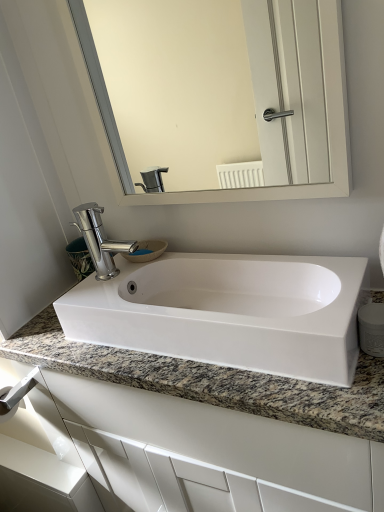
Question: From the image's perspective, is satin nickel towel bar at lower left over white glossy sink at center?

Choices:
 (A) no
 (B) yes

Answer: (A)

Question: Is satin nickel towel bar at lower left positioned beyond the bounds of white glossy sink at center?

Choices:
 (A) yes
 (B) no

Answer: (A)

Question: Is satin nickel towel bar at lower left smaller than white glossy sink at center?

Choices:
 (A) no
 (B) yes

Answer: (B)

Question: Could you tell me if satin nickel towel bar at lower left is facing white glossy sink at center?

Choices:
 (A) yes
 (B) no

Answer: (A)

Question: Can you confirm if satin nickel towel bar at lower left is thinner than white glossy sink at center?

Choices:
 (A) no
 (B) yes

Answer: (B)

Question: Is satin nickel towel bar at lower left with white glossy sink at center?

Choices:
 (A) yes
 (B) no

Answer: (B)

Question: Can you confirm if granite at center is smaller than polished chrome faucet at center?

Choices:
 (A) yes
 (B) no

Answer: (B)

Question: From the image's perspective, is granite at center under polished chrome faucet at center?

Choices:
 (A) yes
 (B) no

Answer: (A)

Question: From a real-world perspective, is granite at center physically above polished chrome faucet at center?

Choices:
 (A) yes
 (B) no

Answer: (B)

Question: Is granite at center positioned before polished chrome faucet at center?

Choices:
 (A) yes
 (B) no

Answer: (A)

Question: Considering the relative sizes of granite at center and polished chrome faucet at center in the image provided, is granite at center wider than polished chrome faucet at center?

Choices:
 (A) yes
 (B) no

Answer: (A)

Question: Could you tell me if granite at center is facing polished chrome faucet at center?

Choices:
 (A) no
 (B) yes

Answer: (A)

Question: Is polished chrome faucet at center thinner than granite at center?

Choices:
 (A) yes
 (B) no

Answer: (A)